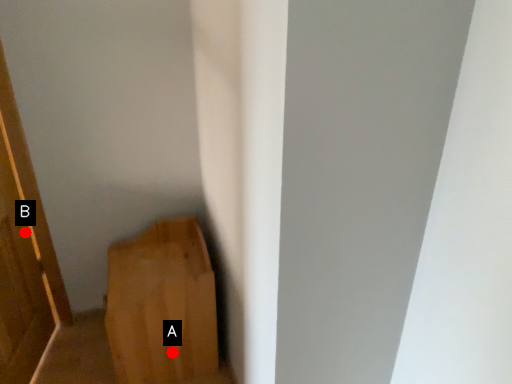
Question: Two points are circled on the image, labeled by A and B beside each circle. Which of the following is the farthest from the observer?

Choices:
 (A) A is further
 (B) B is further

Answer: (B)